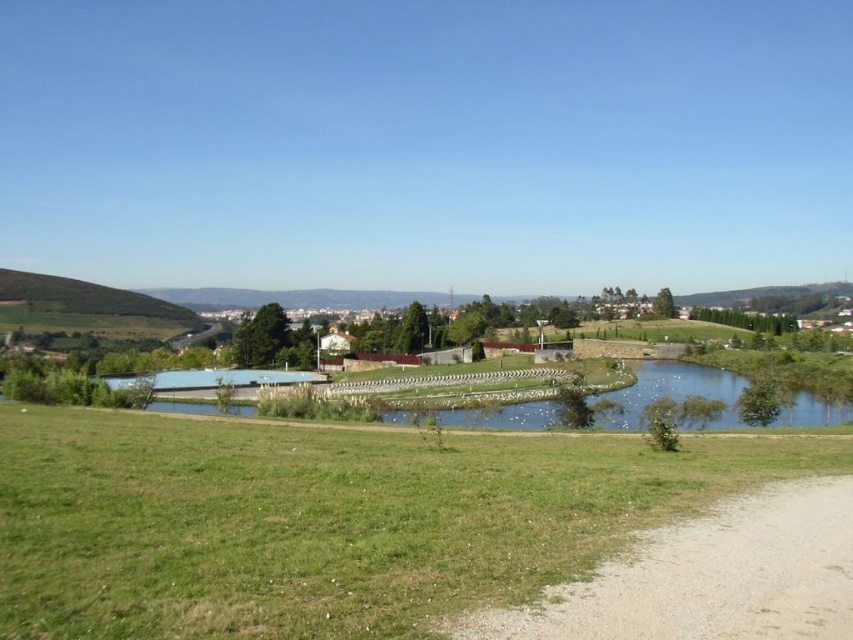
You are planning a picnic and want to set up your blanket on the most elevated spot in the image. Based on the scene, which location would you choose between the gravelly dirt path at lower right and the green grassy hill at left?

The green grassy hill at left is the most elevated spot because the gravelly dirt path at lower right is positioned below it.